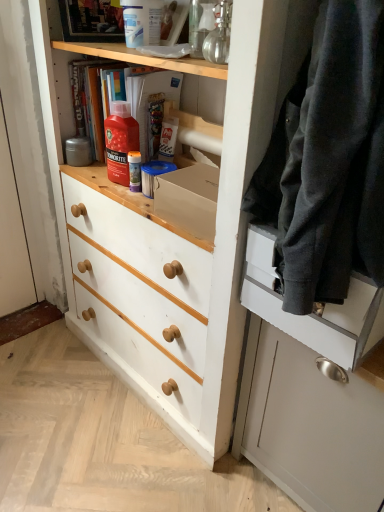
Question: Would you say satin white cabinet at right is inside or outside white painted wood chest of drawers at center?

Choices:
 (A) inside
 (B) outside

Answer: (B)

Question: Considering the positions of point pos(370,307) and point pos(256,39), is point pos(370,307) closer or farther from the camera than point pos(256,39)?

Choices:
 (A) closer
 (B) farther

Answer: (B)

Question: Considering the real-world distances, which object is farthest from the red glossy bottle at upper center?

Choices:
 (A) satin white cabinet at right
 (B) dark gray wool sweater at right
 (C) white painted wood chest of drawers at center
 (D) matte black drawer at right

Answer: (A)

Question: Based on their relative distances, which object is farther from the satin white cabinet at right?

Choices:
 (A) dark gray wool sweater at right
 (B) matte black drawer at right
 (C) red glossy bottle at upper center
 (D) white painted wood chest of drawers at center

Answer: (C)